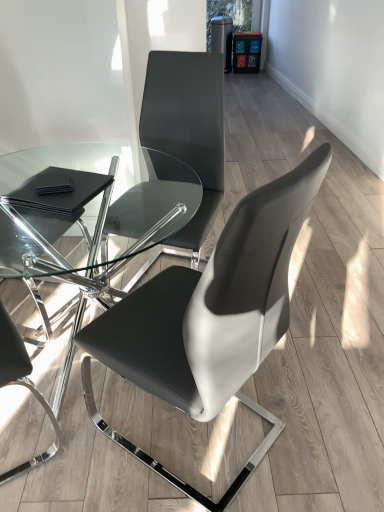
Question: Is black leather chair at left, arranged as the 3th chair when viewed from the right, facing away from black leather pads at lower left?

Choices:
 (A) yes
 (B) no

Answer: (B)

Question: Is black leather chair at left, arranged as the 3th chair when viewed from the right, positioned far away from black leather pads at lower left?

Choices:
 (A) yes
 (B) no

Answer: (B)

Question: Is black leather chair at left, which is the first chair from left to right, directly adjacent to black leather pads at lower left?

Choices:
 (A) no
 (B) yes

Answer: (A)

Question: Does black leather chair at left, arranged as the 3th chair when viewed from the right, have a larger size compared to black leather pads at lower left?

Choices:
 (A) yes
 (B) no

Answer: (A)

Question: Can you confirm if black leather chair at left, arranged as the 3th chair when viewed from the right, is smaller than black leather pads at lower left?

Choices:
 (A) no
 (B) yes

Answer: (A)

Question: Does point (205, 156) appear closer or farther from the camera than point (79, 201)?

Choices:
 (A) farther
 (B) closer

Answer: (A)

Question: Considering the relative positions of matte black chair at center, which is the 2th chair in left-to-right order, and black leather pads at lower left in the image provided, is matte black chair at center, which is the 2th chair in left-to-right order, to the left or to the right of black leather pads at lower left?

Choices:
 (A) left
 (B) right

Answer: (B)

Question: Based on their sizes in the image, would you say matte black chair at center, marked as the 2th chair in a right-to-left arrangement, is bigger or smaller than black leather pads at lower left?

Choices:
 (A) big
 (B) small

Answer: (A)

Question: From the image's perspective, relative to black leather pads at lower left, is matte black chair at center, which is the 2th chair in left-to-right order, above or below?

Choices:
 (A) above
 (B) below

Answer: (A)

Question: Is black leather chair at left, which is the first chair from left to right, taller or shorter than matte black chair at center, the 3th chair viewed from the left?

Choices:
 (A) short
 (B) tall

Answer: (B)

Question: In terms of width, does black leather chair at left, which is the first chair from left to right, look wider or thinner when compared to matte black chair at center, which is counted as the first chair, starting from the right?

Choices:
 (A) wide
 (B) thin

Answer: (B)

Question: In terms of size, does black leather chair at left, arranged as the 3th chair when viewed from the right, appear bigger or smaller than matte black chair at center, the 3th chair viewed from the left?

Choices:
 (A) big
 (B) small

Answer: (B)

Question: From a real-world perspective, is black leather chair at left, arranged as the 3th chair when viewed from the right, physically located above or below matte black chair at center, the 3th chair viewed from the left?

Choices:
 (A) above
 (B) below

Answer: (A)

Question: From the image's perspective, relative to black leather chair at left, arranged as the 3th chair when viewed from the right, is black leather pads at lower left above or below?

Choices:
 (A) above
 (B) below

Answer: (A)

Question: Is black leather pads at lower left taller or shorter than black leather chair at left, which is the first chair from left to right?

Choices:
 (A) tall
 (B) short

Answer: (B)